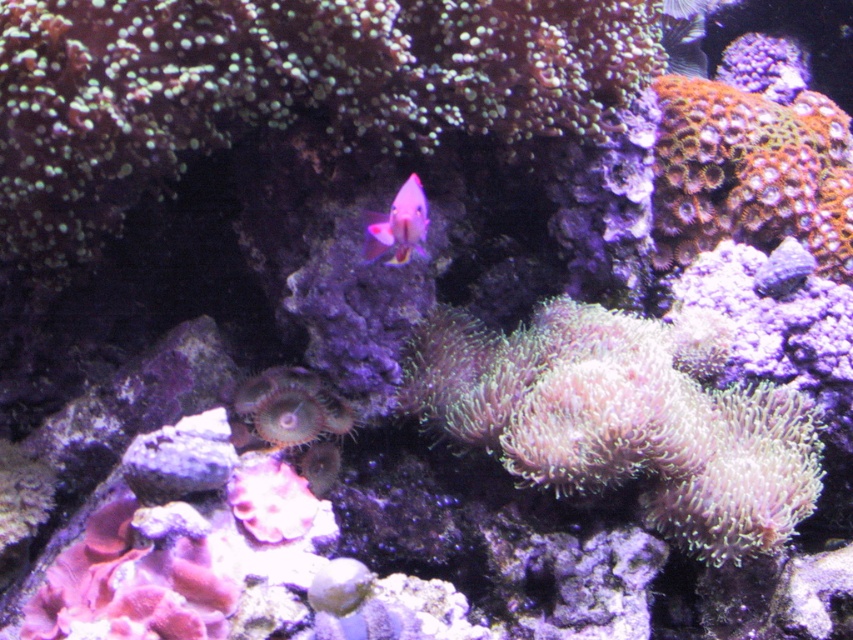
Looking at this image, you are a marine biologist observing this underwater scene. You notice the green translucent coral at center and the pink glossy fish at center. Which object is taller in this image?

The pink glossy fish at center is taller than the green translucent coral at center.

You are a scuba diver swimming in the underwater scene. You want to take a photo of the fish at the center. The camera you are using has a maximum focus range of 5 feet. Is the point at (x=282, y=396) within the camera focus range?

The distance between the point at (x=282, y=396) and the camera is 7.41 feet, which exceeds the camera maximum focus range of 5 feet. Therefore, the camera cannot focus on the point at (x=282, y=396).

You are an underwater photographer aiming to capture the pink glossy fish at center and the purple coral at center in the same frame. Given their sizes, which one will appear bigger in your photo?

The pink glossy fish at center is larger in size than the purple coral at center, so it will appear bigger in the photo.